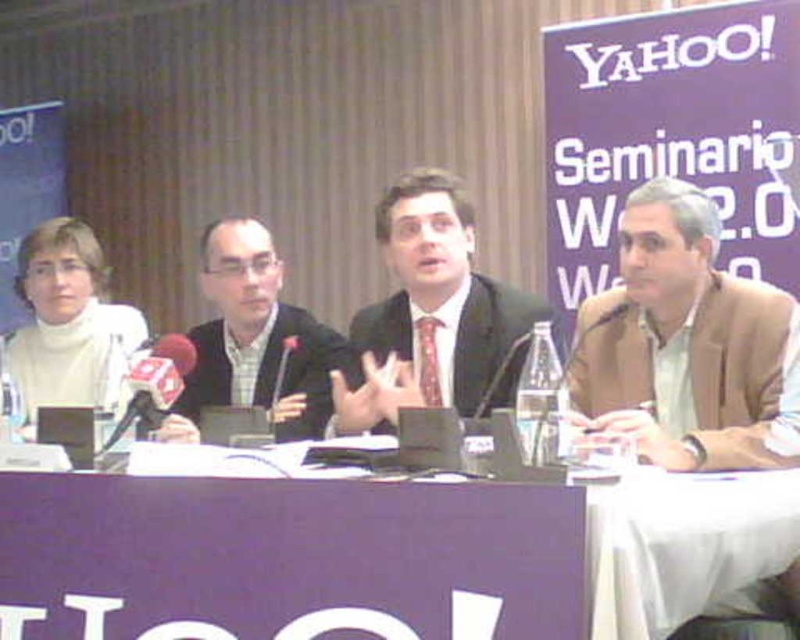
You are attending the Yahoo! Seminario Web 2.0 and need to locate the speaker wearing the brown leather jacket at right and the one in the white matte sweater at left. From your perspective facing the stage, which speaker is seated farther to the right?

The brown leather jacket at right is seated farther to the right compared to the white matte sweater at left.

You are standing at the entrance of the conference room and want to find the person in the matte black suit at center. According to the coordinate system where the bottom left corner is the origin, can you estimate where this person is located?

The matte black suit at center is located at coordinates approximately 0.495 on the x axis and 0.541 on the y axis, so the person is near the center of the room.